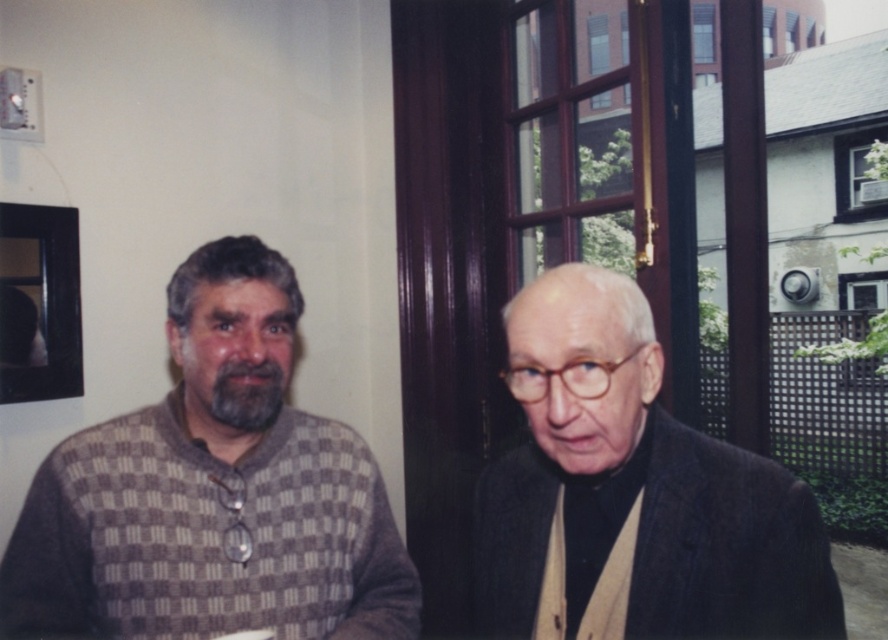
You are a photographer setting up a shoot in the room. You need to place a light source so that it illuminates both the checkered sweater at left and the dark gray wool suit at right equally. Given their positions, where should you place the light source relative to the two people?

The checkered sweater at left is positioned under the dark gray wool suit at right. To illuminate both equally, the light source should be placed above the dark gray wool suit at right so that it can cast light downward onto both the checkered sweater at left and the suit.

You are a photographer setting up for a portrait. You need to ensure there is enough space between the two subjects wearing the checkered sweater at left and the dark gray wool suit at right for a comfortable pose. The minimum recommended distance for such a pose is 12 inches. Based on the scene, is the current spacing sufficient?

The checkered sweater at left is 13.16 inches from the dark gray wool suit at right, which exceeds the minimum recommended distance of 12 inches. Therefore, the current spacing is sufficient for a comfortable pose.

You are a photographer setting up for a portrait. You need to ensure that both the checkered sweater at left and the dark gray wool suit at right are fully visible in the frame. Given their current positions, which adjustment should you make to the camera angle to achieve this?

Since the dark gray wool suit at right is behind the checkered sweater at left, you should move the camera angle slightly to the right to ensure both are fully visible without one blocking the other.